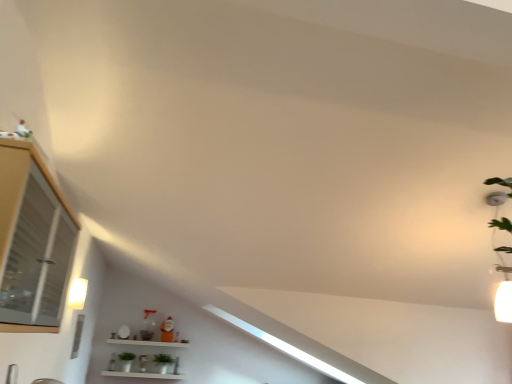
Measure the distance between point [40,195] and camera.

Point [40,195] and camera are 1.29 meters apart.

The width and height of the screenshot is (512, 384). What do you see at coordinates (163, 359) in the screenshot?
I see `green matte plant at lower center` at bounding box center [163, 359].

What are the coordinates of `matte glass cabinet at left` in the screenshot? It's located at (32, 237).

In terms of height, does green matte plant at lower center look taller or shorter compared to matte glass cabinet at left?

Clearly, green matte plant at lower center is shorter compared to matte glass cabinet at left.

In the scene shown: Is green matte plant at lower center wider than matte glass cabinet at left?

No.

Is green matte plant at lower center oriented away from matte glass cabinet at left?

No, green matte plant at lower center's orientation is not away from matte glass cabinet at left.

Is green matte plant at lower center directly adjacent to matte glass cabinet at left?

No, green matte plant at lower center is not making contact with matte glass cabinet at left.

Looking at this image, based on their sizes in the image, would you say white glossy shelf at lower center is bigger or smaller than green matte plant at lower center?

In the image, white glossy shelf at lower center appears to be larger than green matte plant at lower center.

In the scene shown: Measure the distance between white glossy shelf at lower center and green matte plant at lower center.

A distance of 10.22 inches exists between white glossy shelf at lower center and green matte plant at lower center.

Does point (126, 341) come farther from viewer compared to point (172, 361)?

No, it is in front of (172, 361).

Is green matte plant at lower center far away from white glossy shelf at lower center?

Actually, green matte plant at lower center and white glossy shelf at lower center are a little close together.

From the image's perspective, is green matte plant at lower center on white glossy shelf at lower center?

No.

From a real-world perspective, between green matte plant at lower center and white glossy shelf at lower center, who is vertically higher?

white glossy shelf at lower center is physically above.

Between green matte plant at lower center and white glossy shelf at lower center, which one has more height?

white glossy shelf at lower center is taller.

Which of these two, green matte plant at lower center or matte white light fixture at left, is smaller?

Smaller between the two is matte white light fixture at left.

From the image's perspective, who appears lower, green matte plant at lower center or matte white light fixture at left?

green matte plant at lower center appears lower in the image.

Which object is further away from the camera, green matte plant at lower center or matte white light fixture at left?

Positioned behind is green matte plant at lower center.

Considering the relative positions of matte glass cabinet at left and matte white light fixture at left in the image provided, is matte glass cabinet at left to the left or to the right of matte white light fixture at left?

Based on their positions, matte glass cabinet at left is located to the right of matte white light fixture at left.

Is matte glass cabinet at left smaller than matte white light fixture at left?

No, matte glass cabinet at left is not smaller than matte white light fixture at left.

From a real-world perspective, is matte glass cabinet at left beneath matte white light fixture at left?

Yes, from a real-world perspective, matte glass cabinet at left is below matte white light fixture at left.

Would you say matte white light fixture at left is part of matte glass cabinet at left's contents?

Actually, matte white light fixture at left is outside matte glass cabinet at left.

Considering the relative sizes of matte white light fixture at left and green matte plant at lower center in the image provided, is matte white light fixture at left taller than green matte plant at lower center?

Incorrect, the height of matte white light fixture at left is not larger of that of green matte plant at lower center.

Considering the positions of objects matte white light fixture at left and green matte plant at lower center in the image provided, who is behind, matte white light fixture at left or green matte plant at lower center?

green matte plant at lower center is more distant.

From the image's perspective, would you say matte white light fixture at left is shown under green matte plant at lower center?

Incorrect, from the image's perspective, matte white light fixture at left is higher than green matte plant at lower center.

Image resolution: width=512 pixels, height=384 pixels. In order to click on light fixture lying in front of the green matte plant at lower center in this screenshot , I will do `click(78, 293)`.

How distant is white glossy shelf at lower center from matte white light fixture at left?

white glossy shelf at lower center is 7.82 feet away from matte white light fixture at left.

Can you tell me how much white glossy shelf at lower center and matte white light fixture at left differ in facing direction?

They differ by 89.4 degrees in their facing directions.

Is white glossy shelf at lower center not near matte white light fixture at left?

white glossy shelf at lower center is far away from matte white light fixture at left.

From the image's perspective, relative to matte white light fixture at left, is white glossy shelf at lower center above or below?

Clearly, from the image's perspective, white glossy shelf at lower center is below matte white light fixture at left.

Locate an element on the screen. This screenshot has height=384, width=512. plant on the left of matte glass cabinet at left is located at coordinates (163, 359).

Find the location of a particular element. This screenshot has width=512, height=384. shelf that appears in front of the green matte plant at lower center is located at coordinates (148, 343).

Estimate the real-world distances between objects in this image. Which object is closer to white glossy shelf at lower center, green matte plant at lower center or matte white light fixture at left?

green matte plant at lower center.

Considering their positions, is green matte plant at lower center positioned closer to white glossy shelf at lower center than matte glass cabinet at left?

Based on the image, green matte plant at lower center appears to be nearer to white glossy shelf at lower center.

Considering their positions, is matte glass cabinet at left positioned closer to matte white light fixture at left than green matte plant at lower center?

The object closer to matte white light fixture at left is matte glass cabinet at left.

Considering their positions, is matte white light fixture at left positioned closer to white glossy shelf at lower center than matte glass cabinet at left?

matte white light fixture at left is positioned closer to the anchor white glossy shelf at lower center.

Estimate the real-world distances between objects in this image. Which object is closer to matte white light fixture at left, green matte plant at lower center or white glossy shelf at lower center?

The object closer to matte white light fixture at left is white glossy shelf at lower center.

Which object lies further to the anchor point matte glass cabinet at left, white glossy shelf at lower center or green matte plant at lower center?

green matte plant at lower center.

When comparing their distances from matte white light fixture at left, does white glossy shelf at lower center or green matte plant at lower center seem closer?

white glossy shelf at lower center is positioned closer to the anchor matte white light fixture at left.

Based on their spatial positions, is green matte plant at lower center or matte white light fixture at left closer to matte glass cabinet at left?

The object closer to matte glass cabinet at left is matte white light fixture at left.

You are a GUI agent. You are given a task and a screenshot of the screen. Output one action in this format:
    pyautogui.click(x=<x>, y=<y>)
    Task: Click on the light fixture located between matte glass cabinet at left and white glossy shelf at lower center in the depth direction
    This screenshot has height=384, width=512.
    Given the screenshot: What is the action you would take?
    pyautogui.click(x=78, y=293)

I want to click on light fixture between matte glass cabinet at left and green matte plant at lower center from front to back, so click(78, 293).

The height and width of the screenshot is (384, 512). Identify the location of shelf between matte glass cabinet at left and green matte plant at lower center along the z-axis. (148, 343).

Find the location of a particular element. shelf between matte white light fixture at left and green matte plant at lower center in the front-back direction is located at coordinates (148, 343).